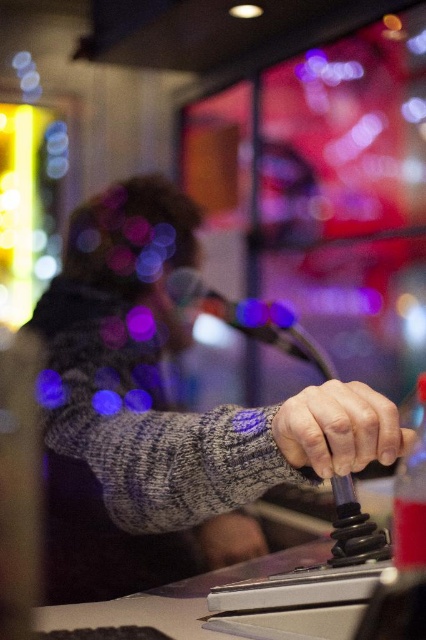
You are a photographer trying to capture the scene in the image. You notice the gray knitted sweater at center and the smooth gray hand at center. Which object should you focus on if you want to highlight something that appears taller in the frame?

The gray knitted sweater at center is much taller as smooth gray hand at center, so you should focus on the gray knitted sweater at center to highlight the taller object.

You are standing in the arcade and see two points in the image. The first point is at coordinates point [94,216] and the second is at point [411,440]. Which point is closer to you?

Point [94,216] is closer to you because it is further to the viewer than point [411,440].

You are a photographer trying to capture the texture of the smooth gray hand at center without the gray knitted sweater at center blocking it. What should you do?

The gray knitted sweater at center is positioned over the smooth gray hand at center, so you need to move the sweater out of the way to capture the hand texture clearly.